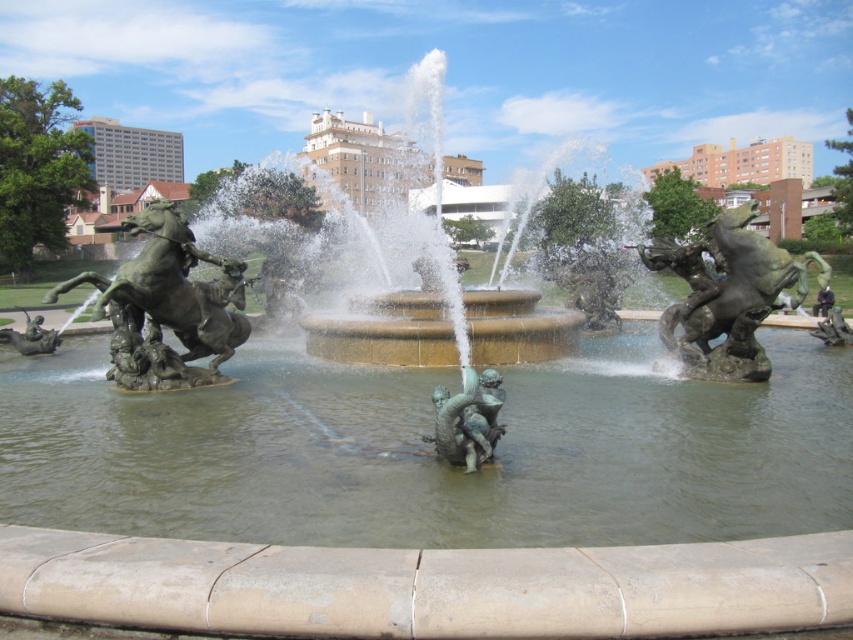
Question: Is bronze/golden horse at left bigger than bronze statue at center?

Choices:
 (A) no
 (B) yes

Answer: (B)

Question: Does bronze/golden horse at left appear over green patina bronze children at center?

Choices:
 (A) yes
 (B) no

Answer: (A)

Question: Estimate the real-world distances between objects in this image. Which object is farther from the bronze/golden horse at left?

Choices:
 (A) bronze statue at center
 (B) bronze/golden horse at right
 (C) green patina bronze children at center
 (D) bronze statue at lower left

Answer: (A)

Question: Can you confirm if bronze/golden horse at left is thinner than green patina bronze children at center?

Choices:
 (A) yes
 (B) no

Answer: (B)

Question: Which point is closer to the camera taking this photo?

Choices:
 (A) (729, 234)
 (B) (41, 342)
 (C) (462, 493)

Answer: (C)

Question: Which object appears farthest from the camera in this image?

Choices:
 (A) bronze statue at lower left
 (B) bronze/golden horse at right
 (C) green patina water at center
 (D) bronze statue at center

Answer: (D)